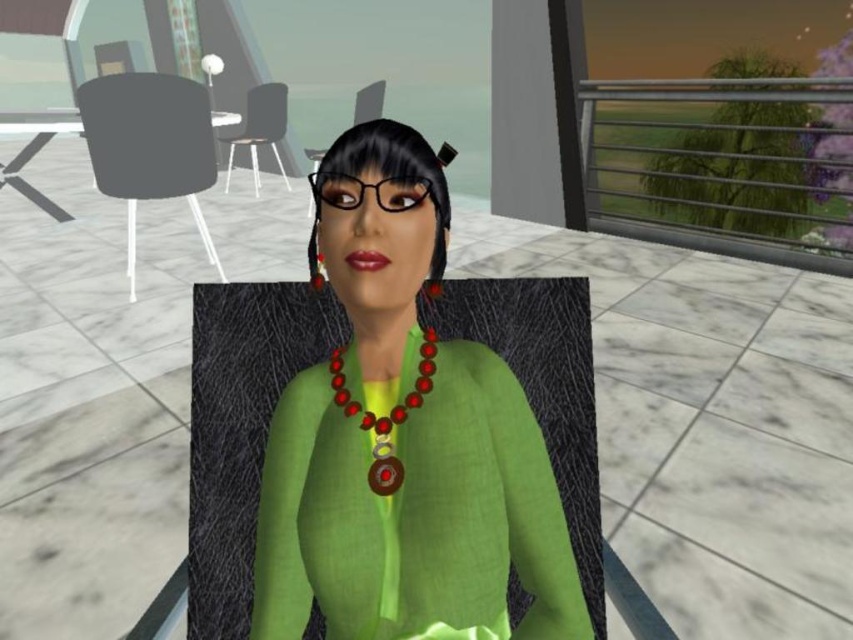
Does green linen blouse at center have a lesser width compared to matte black armchair at left?

Yes.

Can you confirm if green linen blouse at center is positioned below matte black armchair at left?

Correct, green linen blouse at center is located below matte black armchair at left.

Does point (363, 317) lie in front of point (119, 172)?

Yes, it is in front of point (119, 172).

Identify the location of green linen blouse at center. Image resolution: width=853 pixels, height=640 pixels. (403, 440).

Is green linen blouse at center positioned before matte black armchair at upper left?

Yes, green linen blouse at center is closer to the viewer.

At what (x,y) coordinates should I click in order to perform the action: click on green linen blouse at center. Please return your answer as a coordinate pair (x, y). This screenshot has height=640, width=853. Looking at the image, I should click on (403, 440).

This screenshot has width=853, height=640. Identify the location of green linen blouse at center. (403, 440).

Find the location of `green linen blouse at center`. green linen blouse at center is located at coordinates (403, 440).

Between point (381, 92) and point (320, 259), which one is positioned behind?

The point (381, 92) is more distant.

The image size is (853, 640). What do you see at coordinates (368, 100) in the screenshot? I see `green fabric armchair at center` at bounding box center [368, 100].

Between point (383, 88) and point (320, 266), which one is positioned in front?

Point (320, 266) is more forward.

Locate an element on the screen. The image size is (853, 640). green fabric armchair at center is located at coordinates (368, 100).